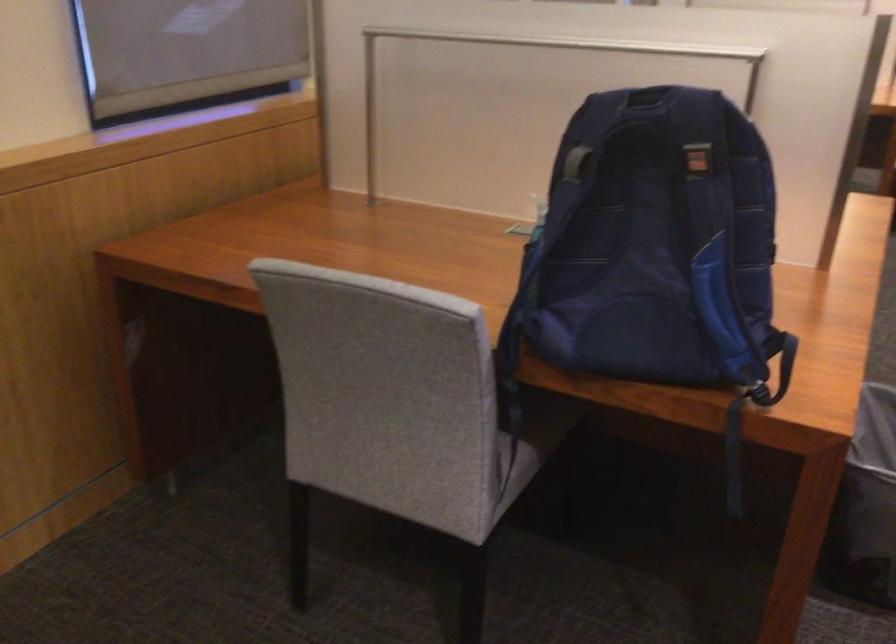
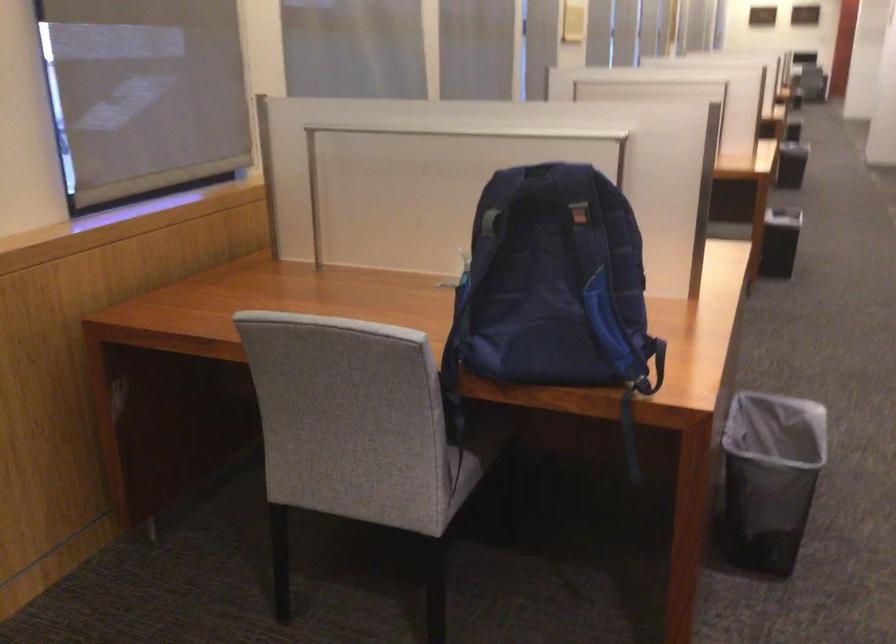
In the second image, find the point that corresponds to (x=649, y=249) in the first image.

(552, 281)